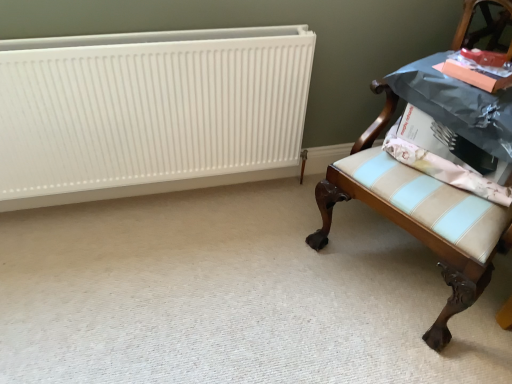
This screenshot has height=384, width=512. I want to click on free region under wooden upholstered chair at right (from a real-world perspective), so click(x=393, y=265).